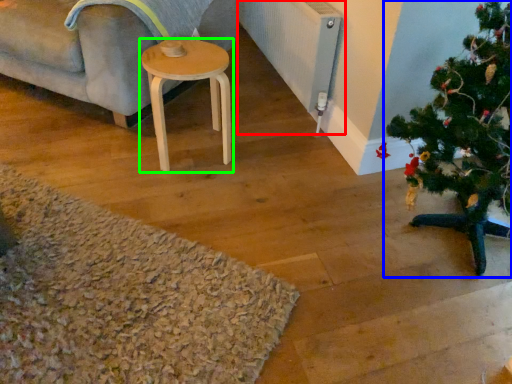
Question: Which object is positioned closest to radiator (highlighted by a red box)? Select from christmas tree (highlighted by a blue box) and stool (highlighted by a green box).

Choices:
 (A) christmas tree
 (B) stool

Answer: (B)